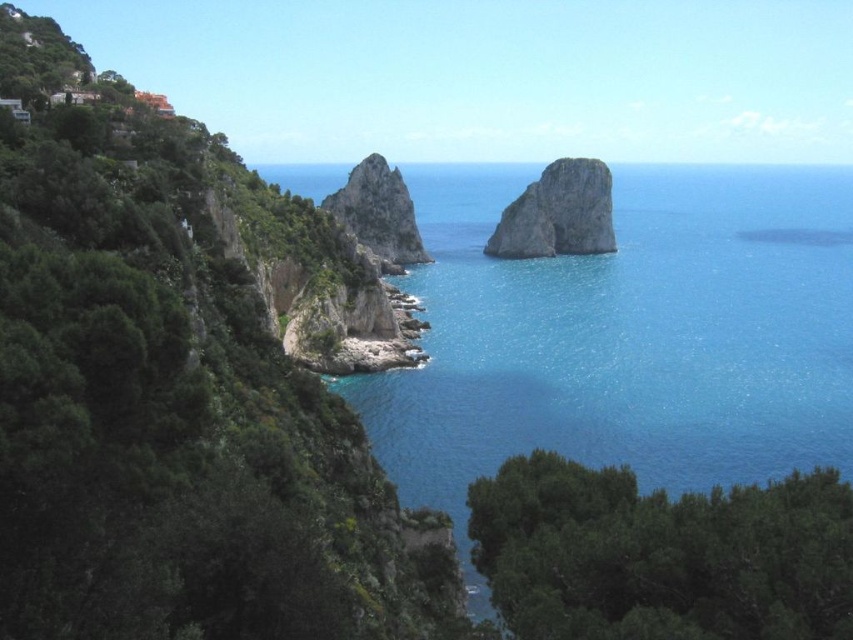
Can you confirm if rocky cliff at center is wider than rough stone rock at center?

Indeed, rocky cliff at center has a greater width compared to rough stone rock at center.

Between point (602, 179) and point (415, 232), which one is positioned in front?

Point (415, 232) is more forward.

I want to click on rocky cliff at center, so 558,212.

Is blue clear water at center behind rocky cliff at center?

No.

Is blue clear water at center thinner than rocky cliff at center?

No.

Between point (514, 296) and point (587, 211), which one is positioned in front?

Point (514, 296)

Where is `blue clear water at center`? blue clear water at center is located at coordinates (625, 336).

Between green leafy hillside at left and rough stone rock at center, which one is positioned lower?

green leafy hillside at left

Who is more forward, [283,579] or [352,176]?

Point [283,579] is in front.

I want to click on green leafy hillside at left, so click(177, 394).